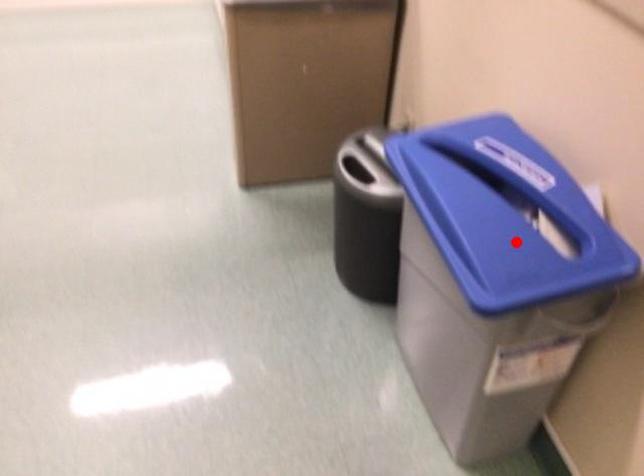
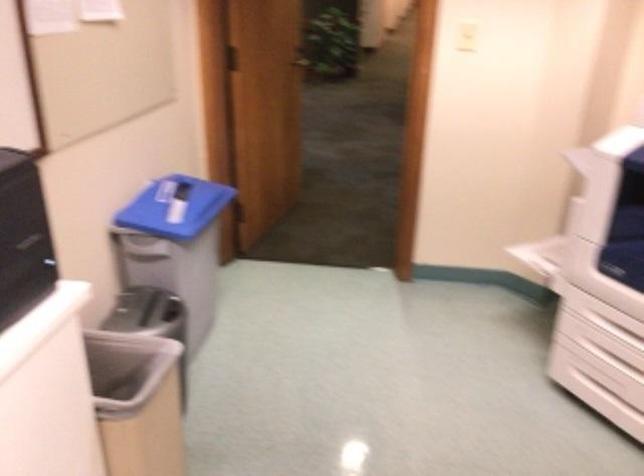
Where in the second image is the point corresponding to the highlighted location from the first image?

(174, 207)